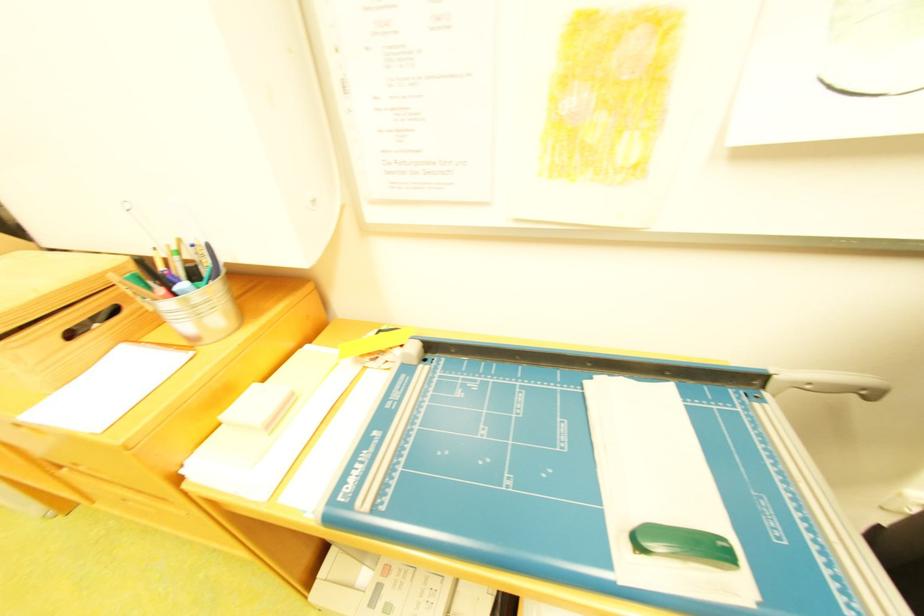
Find where to slid the green sliding handle. Please return your answer as a coordinate pair (x, y).

(438, 305)